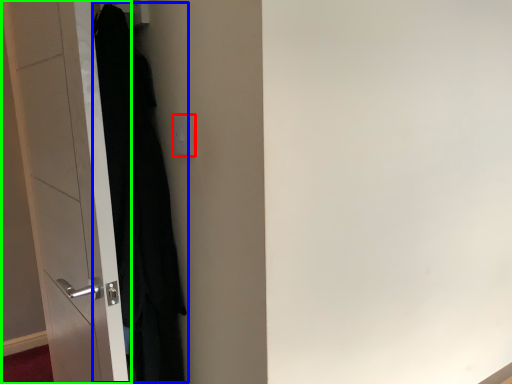
Question: Estimate the real-world distances between objects in this image. Which object is farther from electric outlet (highlighted by a red box), clothing (highlighted by a blue box) or door (highlighted by a green box)?

Choices:
 (A) clothing
 (B) door

Answer: (B)